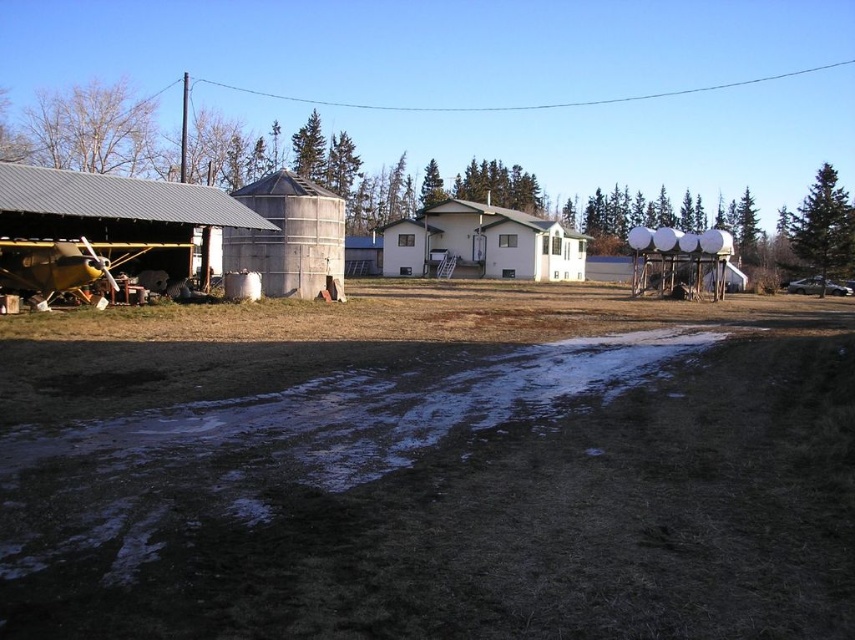
Question: Which object is closer to the camera taking this photo?

Choices:
 (A) white matte house at center
 (B) brushed metal barn at left
 (C) brown grassy field at lower center
 (D) brown grass at lower center

Answer: (D)

Question: Can you confirm if brown grassy field at lower center is wider than brushed metal barn at left?

Choices:
 (A) no
 (B) yes

Answer: (B)

Question: Which of the following is the farthest from the observer?

Choices:
 (A) (526, 308)
 (B) (28, 172)
 (C) (540, 230)
 (D) (753, 369)

Answer: (C)

Question: Is brown grass at lower center to the left of white matte house at center from the viewer's perspective?

Choices:
 (A) no
 (B) yes

Answer: (B)

Question: Can you confirm if brown grass at lower center is positioned to the right of white matte house at center?

Choices:
 (A) yes
 (B) no

Answer: (B)

Question: Estimate the real-world distances between objects in this image. Which object is closer to the brown grassy field at lower center?

Choices:
 (A) white matte house at center
 (B) brushed metal barn at left

Answer: (B)